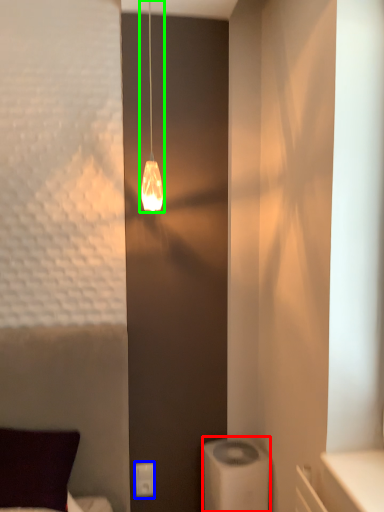
Question: Which is farther away from appliance (highlighted by a red box)? light switch (highlighted by a blue box) or lamp (highlighted by a green box)?

Choices:
 (A) light switch
 (B) lamp

Answer: (B)